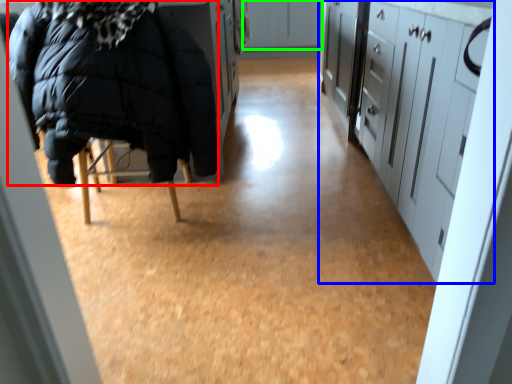
Question: Based on their relative distances, which object is farther from jacket (highlighted by a red box)? Choose from cabinetry (highlighted by a blue box) and cabinetry (highlighted by a green box).

Choices:
 (A) cabinetry
 (B) cabinetry

Answer: (B)